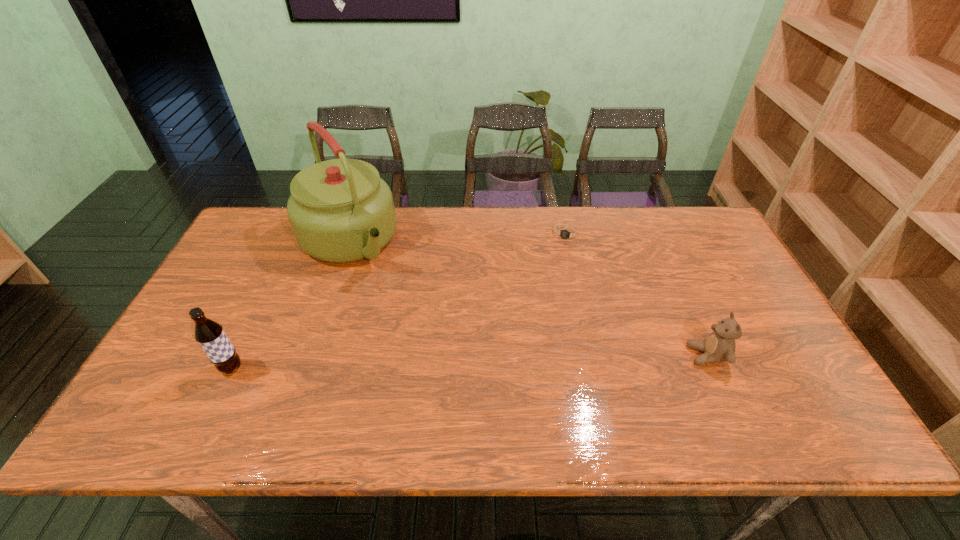
Where is `vacant space situated at the spout of the kettle`? vacant space situated at the spout of the kettle is located at coordinates (419, 333).

Image resolution: width=960 pixels, height=540 pixels. I want to click on vacant space located 0.320m at the spout of the kettle, so click(424, 341).

Locate an element on the screen. vacant area situated 0.290m at the spout of the kettle is located at coordinates (419, 333).

I want to click on vacant space situated on the face of the third object from left to right, so pyautogui.click(x=531, y=328).

The image size is (960, 540). I want to click on vacant position located 0.230m on the face of the third object from left to right, so click(x=543, y=295).

This screenshot has height=540, width=960. I want to click on free space located on the face of the third object from left to right, so click(x=558, y=256).

Locate an element on the screen. kettle that is at the far edge is located at coordinates (340, 210).

Where is `watch present at the far edge`? The width and height of the screenshot is (960, 540). watch present at the far edge is located at coordinates (566, 234).

In order to click on root beer present at the near edge in this screenshot , I will do `click(210, 335)`.

In order to click on teddy bear that is at the near edge in this screenshot , I will do `click(719, 346)`.